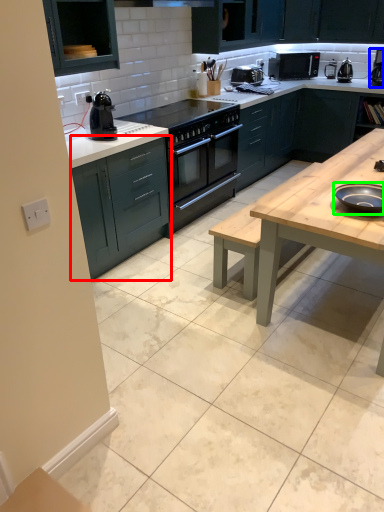
Question: Which object is the farthest from cabinetry (highlighted by a red box)? Choose among these: coffee machine (highlighted by a blue box) or appliance (highlighted by a green box).

Choices:
 (A) coffee machine
 (B) appliance

Answer: (A)